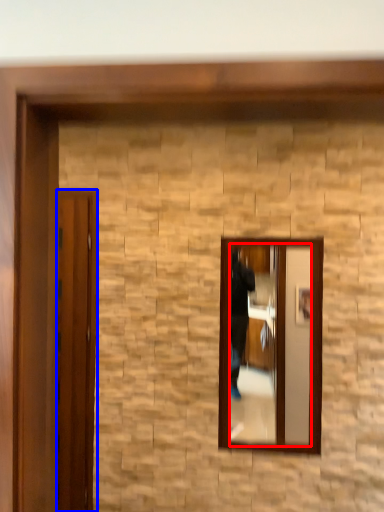
Question: Which of the following is the farthest to the observer, mirror (highlighted by a red box) or door (highlighted by a blue box)?

Choices:
 (A) mirror
 (B) door

Answer: (B)